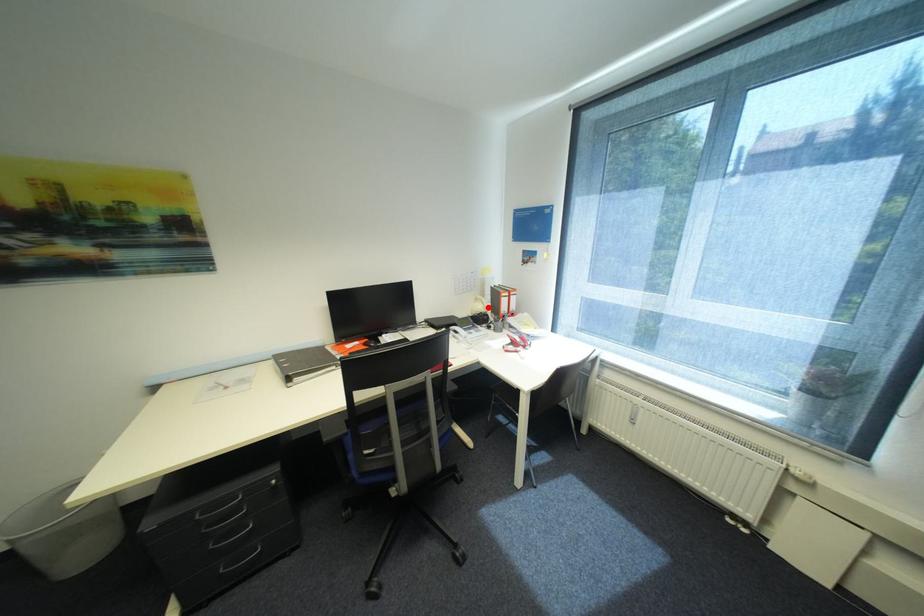
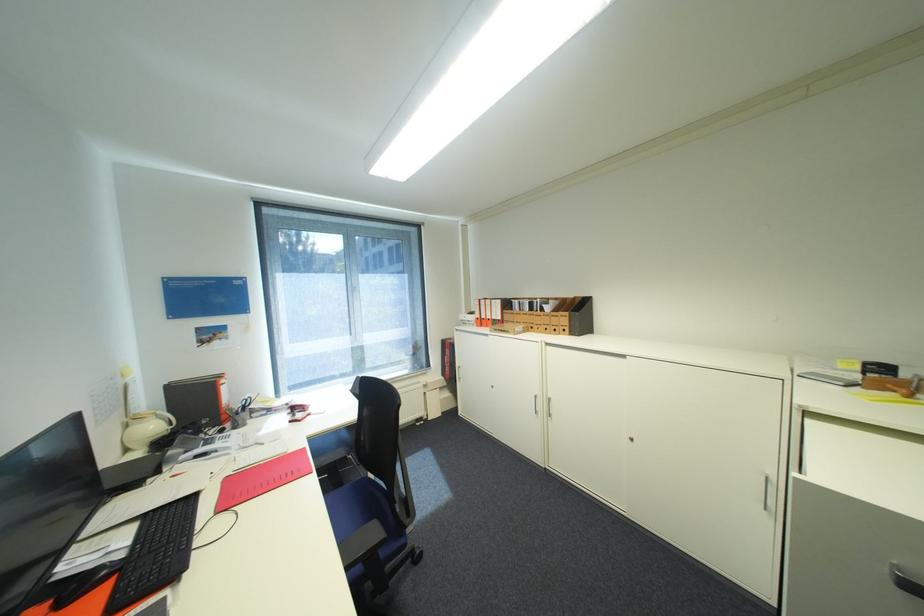
In the second image, find the point that corresponds to the highlighted location in the first image.

(161, 427)